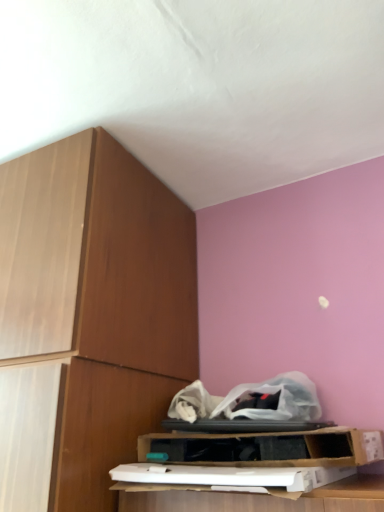
Question: Is wooden cabinet at left to the left or to the right of cardboard box at lower center in the image?

Choices:
 (A) right
 (B) left

Answer: (B)

Question: Is point (91, 261) positioned closer to the camera than point (354, 432)?

Choices:
 (A) closer
 (B) farther

Answer: (B)

Question: Is wooden cabinet at left inside the boundaries of cardboard box at lower center, or outside?

Choices:
 (A) outside
 (B) inside

Answer: (A)

Question: In the image, is cardboard box at lower center positioned in front of or behind wooden cabinet at left?

Choices:
 (A) behind
 (B) front

Answer: (A)

Question: Would you say cardboard box at lower center is to the left or to the right of wooden cabinet at left in the picture?

Choices:
 (A) right
 (B) left

Answer: (A)

Question: Considering the positions of cardboard box at lower center and wooden cabinet at left in the image, is cardboard box at lower center bigger or smaller than wooden cabinet at left?

Choices:
 (A) big
 (B) small

Answer: (B)

Question: Looking at their shapes, would you say cardboard box at lower center is wider or thinner than wooden cabinet at left?

Choices:
 (A) thin
 (B) wide

Answer: (A)